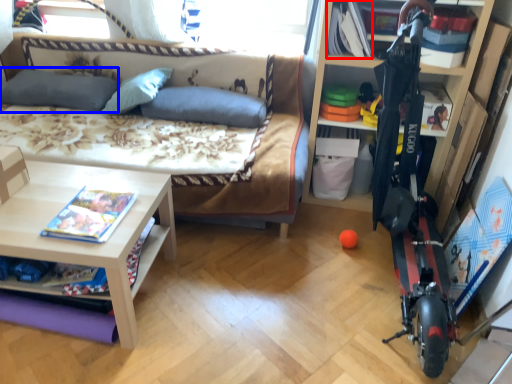
Question: Which of the following is the closest to the observer, book (highlighted by a red box) or pillow (highlighted by a blue box)?

Choices:
 (A) book
 (B) pillow

Answer: (A)